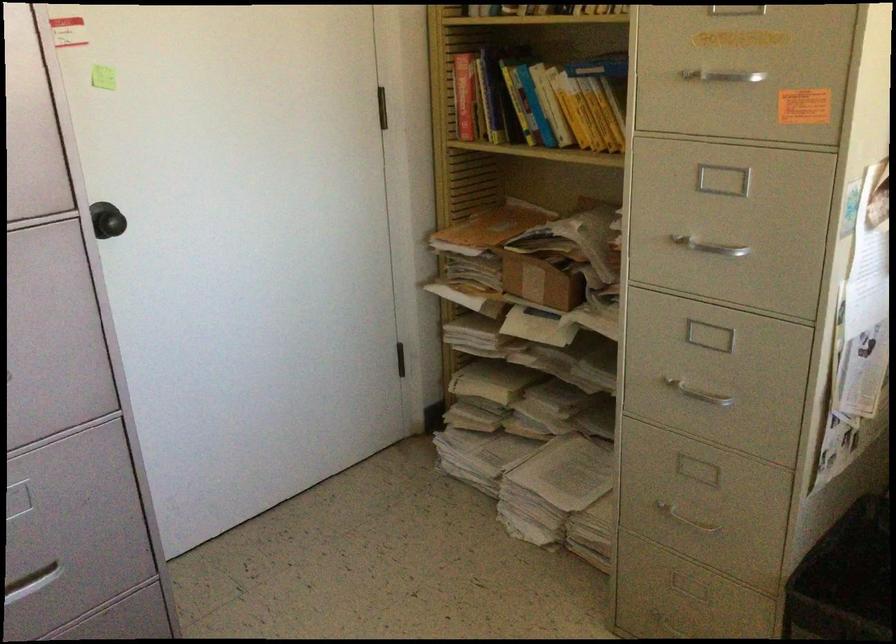
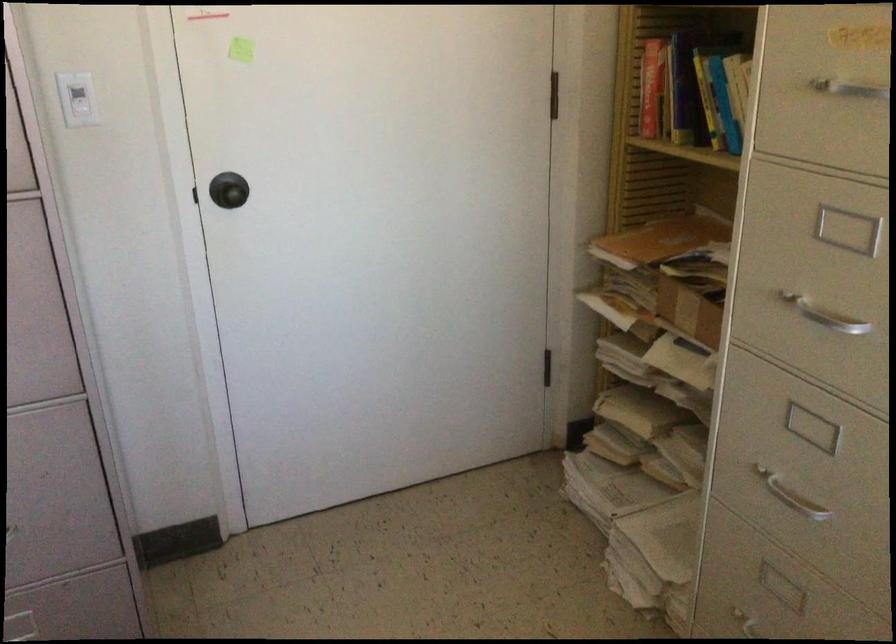
In the second image, find the point that corresponds to [676,506] in the first image.

(754, 625)